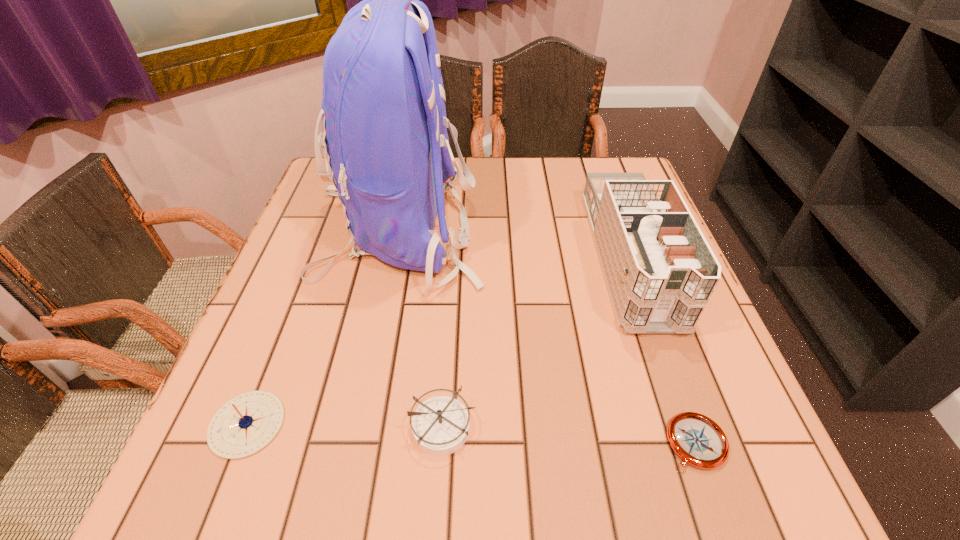
Find the location of a particular element. This screenshot has width=960, height=540. the closest compass relative to the leftmost compass is located at coordinates (440, 425).

I want to click on free region that satisfies the following two spatial constraints: 1. on the back of the backpack; 2. on the left side of the shortest object, so click(x=353, y=443).